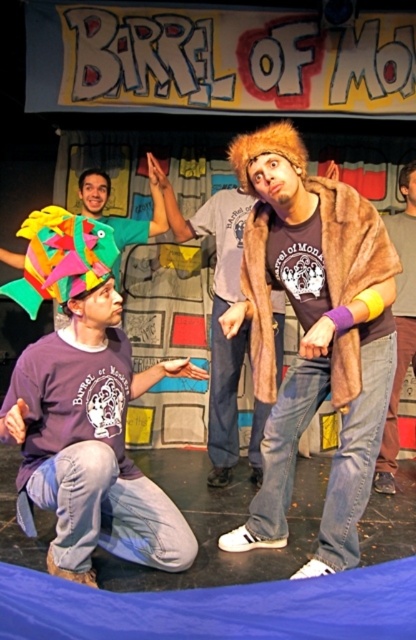
Question: Does fur coat at center appear on the left side of fuzzy brown coat at right?

Choices:
 (A) yes
 (B) no

Answer: (A)

Question: Does fuzzy brown coat at center appear under fuzzy brown coat at right?

Choices:
 (A) yes
 (B) no

Answer: (A)

Question: Which object appears closest to the camera in this image?

Choices:
 (A) fuzzy brown coat at right
 (B) fur coat at center
 (C) fuzzy brown coat at center

Answer: (C)

Question: Which of the following is the farthest from the observer?

Choices:
 (A) fur coat at center
 (B) fuzzy brown coat at right
 (C) fuzzy brown coat at center
 (D) purple cotton shirt at lower left

Answer: (B)

Question: Which of these objects is positioned farthest from the fuzzy brown coat at center?

Choices:
 (A) fuzzy brown coat at right
 (B) purple cotton shirt at lower left

Answer: (A)

Question: Does fuzzy brown coat at center come in front of fur coat at center?

Choices:
 (A) yes
 (B) no

Answer: (A)